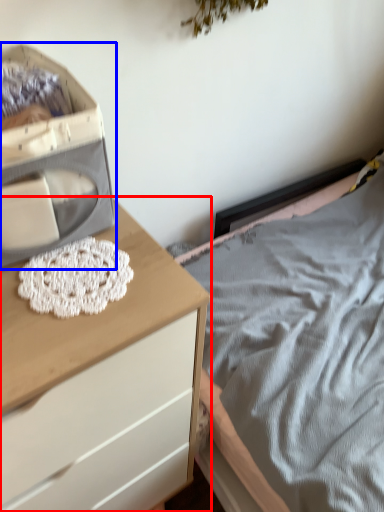
Question: Among these objects, which one is nearest to the camera, chest of drawers (highlighted by a red box) or storage box (highlighted by a blue box)?

Choices:
 (A) chest of drawers
 (B) storage box

Answer: (A)